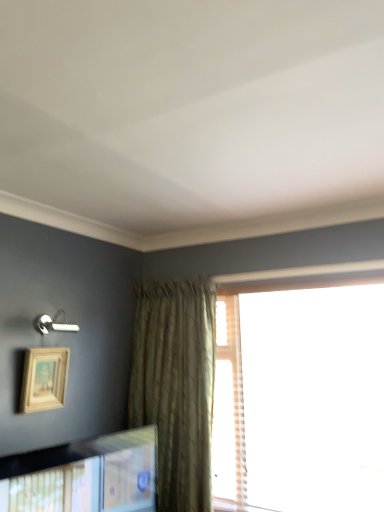
Question: Does wooden picture frame at lower left, which appears as the second picture frame when viewed from the top, have a greater width compared to translucent plaid curtain at right?

Choices:
 (A) yes
 (B) no

Answer: (A)

Question: Does wooden picture frame at lower left, the first picture frame when ordered from bottom to top, appear on the right side of translucent plaid curtain at right?

Choices:
 (A) yes
 (B) no

Answer: (B)

Question: Can you confirm if wooden picture frame at lower left, the first picture frame when ordered from bottom to top, is bigger than translucent plaid curtain at right?

Choices:
 (A) yes
 (B) no

Answer: (B)

Question: Is wooden picture frame at lower left, the first picture frame when ordered from bottom to top, touching translucent plaid curtain at right?

Choices:
 (A) yes
 (B) no

Answer: (B)

Question: Considering the relative positions of wooden picture frame at lower left, which appears as the second picture frame when viewed from the top, and translucent plaid curtain at right in the image provided, is wooden picture frame at lower left, which appears as the second picture frame when viewed from the top, behind translucent plaid curtain at right?

Choices:
 (A) yes
 (B) no

Answer: (B)

Question: Is wooden picture frame at lower left, the first picture frame when ordered from bottom to top, not near translucent plaid curtain at right?

Choices:
 (A) no
 (B) yes

Answer: (B)

Question: From the image's perspective, does translucent plaid curtain at right appear lower than wooden picture frame at lower left, which appears as the second picture frame when viewed from the top?

Choices:
 (A) no
 (B) yes

Answer: (A)

Question: Is translucent plaid curtain at right thinner than wooden picture frame at lower left, the first picture frame when ordered from bottom to top?

Choices:
 (A) yes
 (B) no

Answer: (A)

Question: Is translucent plaid curtain at right to the right of wooden picture frame at lower left, the first picture frame when ordered from bottom to top, from the viewer's perspective?

Choices:
 (A) no
 (B) yes

Answer: (B)

Question: Is translucent plaid curtain at right not within wooden picture frame at lower left, which appears as the second picture frame when viewed from the top?

Choices:
 (A) no
 (B) yes

Answer: (B)

Question: Does translucent plaid curtain at right have a greater height compared to wooden picture frame at lower left, the first picture frame when ordered from bottom to top?

Choices:
 (A) no
 (B) yes

Answer: (B)

Question: Is translucent plaid curtain at right turned away from wooden picture frame at lower left, which appears as the second picture frame when viewed from the top?

Choices:
 (A) yes
 (B) no

Answer: (B)

Question: Is translucent plaid curtain at right smaller than wooden picture frame at upper left, which is the 2th picture frame in bottom-to-top order?

Choices:
 (A) no
 (B) yes

Answer: (A)